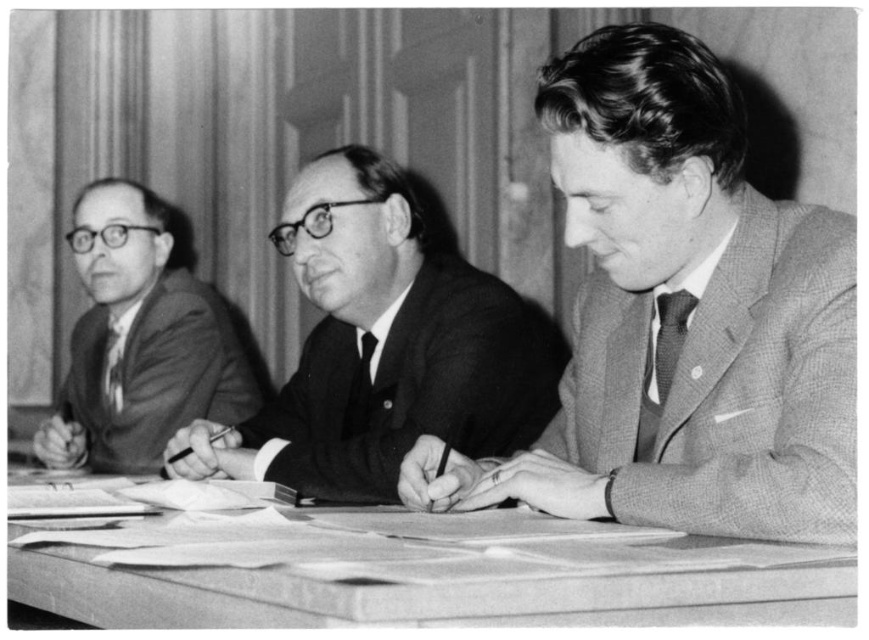
You are a photographer standing behind the table. You want to take a picture of the checkered wool suit at right without the smooth wood table at center appearing in the frame. Is this possible based on their positions?

The smooth wood table at center is below the checkered wool suit at right, so yes, you can take a picture of the checkered wool suit at right without the smooth wood table at center appearing in the frame by angling the camera upwards to exclude the lower area where the table is located.

You are attending a formal meeting and need to sit between the checkered wool suit at right and the smooth suit at left. Based on their positions, which direction should you choose to sit?

The checkered wool suit at right is to the right of the smooth suit at left. To sit between them, you should choose a seat to the right of the smooth suit at left and to the left of the checkered wool suit at right.

You are an event planner organizing a formal event and need to ensure that all attendees have ties that are appropriately sized for their collars. You notice two men in the image wearing ties. Which tie, the matte silk tie at right or the black silk tie at center, would require a larger collar size to accommodate its width?

The black silk tie at center requires a larger collar size because it occupies more space than the matte silk tie at right.